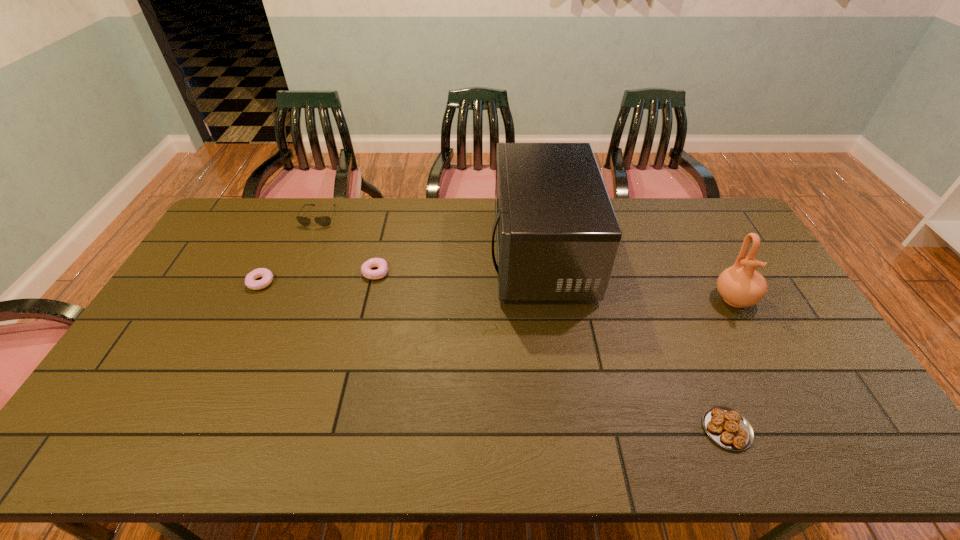
The width and height of the screenshot is (960, 540). I want to click on microwave oven, so click(x=557, y=235).

This screenshot has height=540, width=960. I want to click on the tallest object, so click(x=557, y=235).

I want to click on pottery, so click(x=740, y=285).

Where is `the fifth shortest object`? the fifth shortest object is located at coordinates (740, 285).

The image size is (960, 540). I want to click on sunglasses, so click(x=324, y=221).

Find the location of `the right doughnut`. the right doughnut is located at coordinates (366, 267).

Image resolution: width=960 pixels, height=540 pixels. What are the coordinates of `the left doughnut` in the screenshot? It's located at point(250,281).

Identify the location of pastry. (728, 428).

The width and height of the screenshot is (960, 540). I want to click on the fifth object from left to right, so click(x=728, y=428).

This screenshot has width=960, height=540. Identify the location of vacant area located 0.280m on the front-facing side of the tallest object. (409, 253).